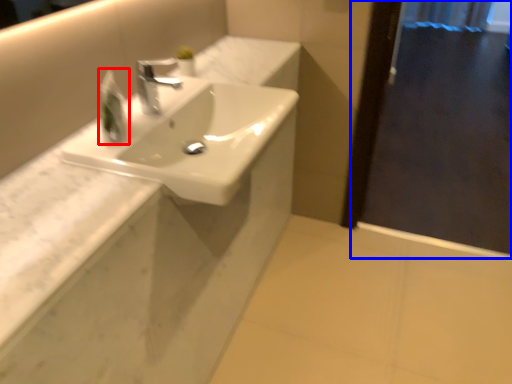
Question: Among these objects, which one is nearest to the camera, soap dispenser (highlighted by a red box) or screen door (highlighted by a blue box)?

Choices:
 (A) soap dispenser
 (B) screen door

Answer: (A)